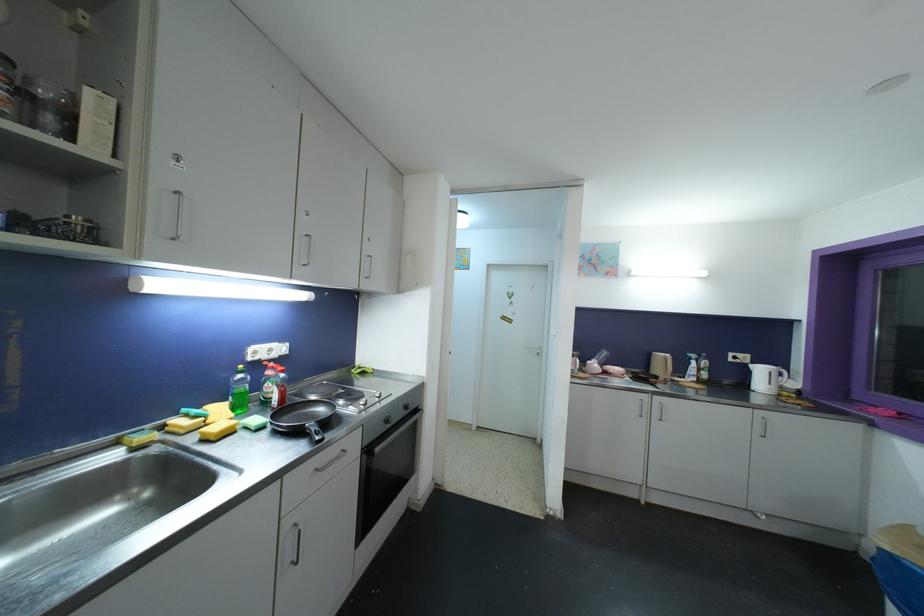
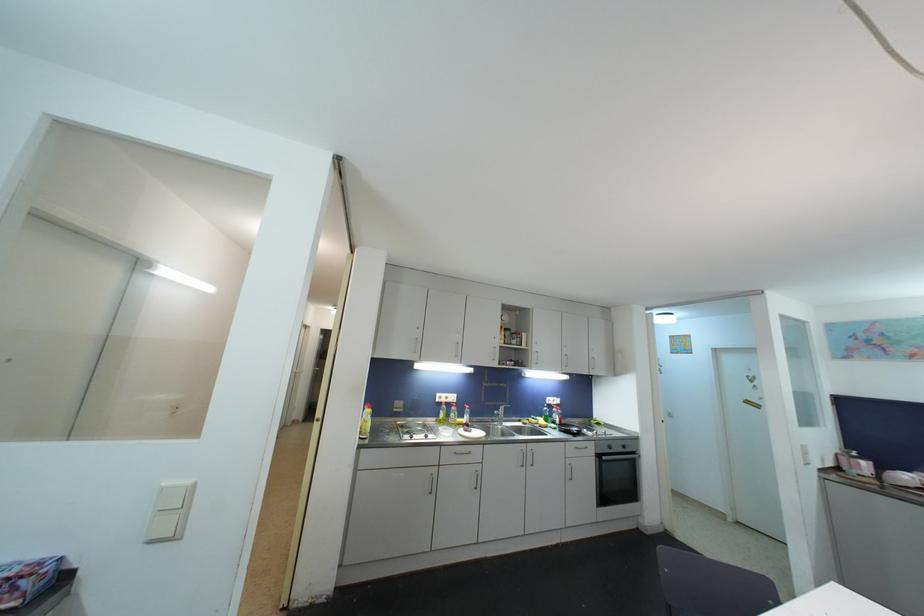
Where in the second image is the point corresponding to (x=390, y=424) from the first image?

(613, 450)